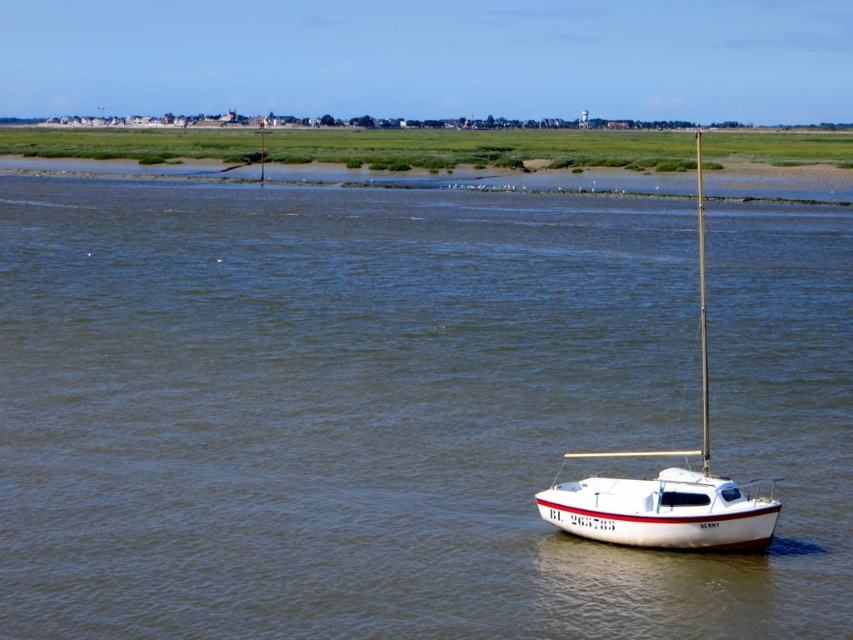
Is brown water at center behind white glossy sailboat at center?

No, it is not.

Is brown water at center to the right of white glossy sailboat at center from the viewer's perspective?

Incorrect, brown water at center is not on the right side of white glossy sailboat at center.

Locate an element on the screen. The image size is (853, 640). brown water at center is located at coordinates (403, 410).

This screenshot has width=853, height=640. I want to click on brown water at center, so click(403, 410).